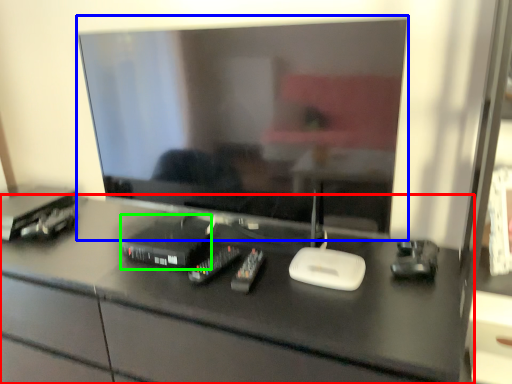
Question: Based on their relative distances, which object is farther from desk (highlighted by a red box)? Choose from television (highlighted by a blue box) and equipment (highlighted by a green box).

Choices:
 (A) television
 (B) equipment

Answer: (A)